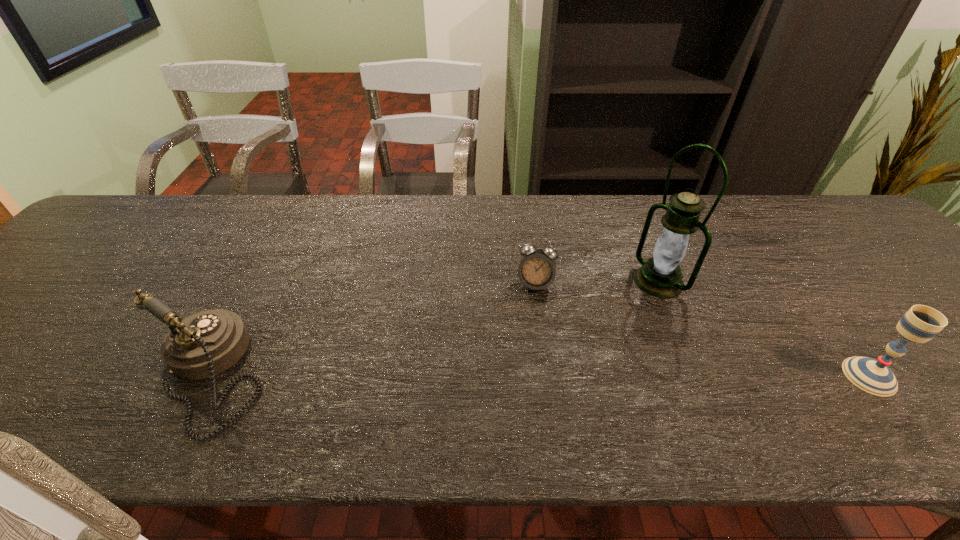
Where is `vacant point located on the side where the second object from right to left emits light`? vacant point located on the side where the second object from right to left emits light is located at coordinates (589, 327).

What are the coordinates of `free space located on the face of the third object from right to left` in the screenshot? It's located at (518, 389).

At what (x,y) coordinates should I click in order to perform the action: click on blank area located on the face of the third object from right to left. Please return your answer as a coordinate pair (x, y). This screenshot has height=540, width=960. Looking at the image, I should click on (529, 322).

Locate an element on the screen. vacant position located 0.150m on the face of the third object from right to left is located at coordinates (526, 343).

This screenshot has height=540, width=960. I want to click on telephone at the near edge, so click(x=205, y=344).

This screenshot has width=960, height=540. What are the coordinates of `chalice that is at the near edge` in the screenshot? It's located at (920, 323).

This screenshot has width=960, height=540. In the image, there is a desktop. Find the location of `free region at the far edge`. free region at the far edge is located at coordinates (636, 212).

Where is `vacant space at the near edge`? The width and height of the screenshot is (960, 540). vacant space at the near edge is located at coordinates (690, 386).

Where is `vacant space at the left edge of the desktop`? The image size is (960, 540). vacant space at the left edge of the desktop is located at coordinates (106, 245).

This screenshot has width=960, height=540. Find the location of `vacant space at the right edge of the desktop`. vacant space at the right edge of the desktop is located at coordinates coord(898,259).